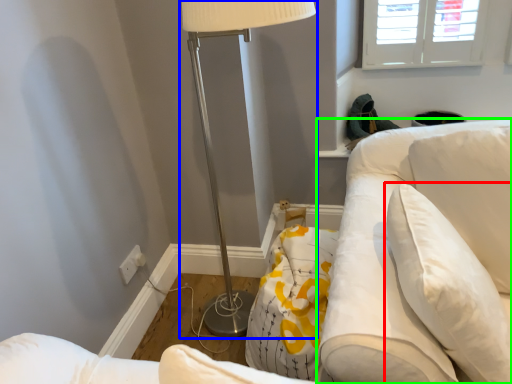
Question: Which object is the closest to the pillow (highlighted by a red box)? Choose among these: lamp (highlighted by a blue box) or swivel chair (highlighted by a green box).

Choices:
 (A) lamp
 (B) swivel chair

Answer: (B)